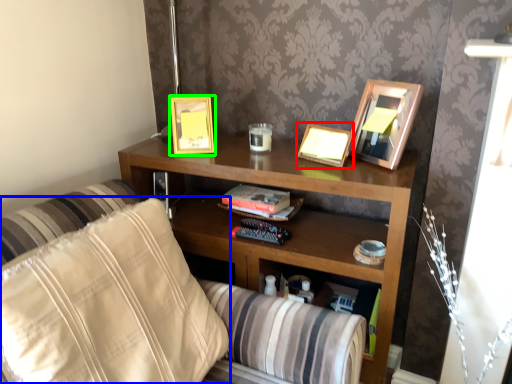
Question: Which object is the closest to the picture frame (highlighted by a red box)? Choose among these: pillow (highlighted by a blue box) or picture frame (highlighted by a green box).

Choices:
 (A) pillow
 (B) picture frame

Answer: (B)